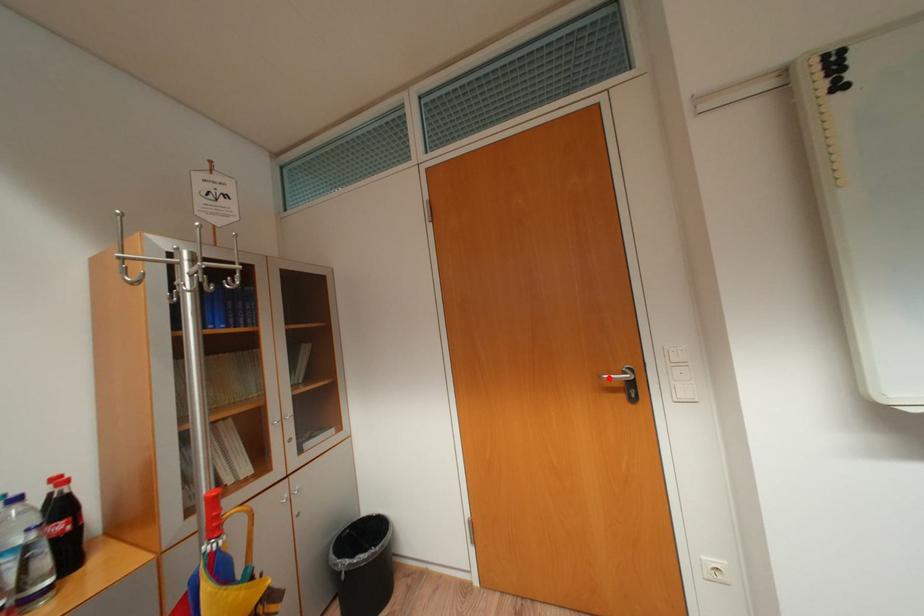
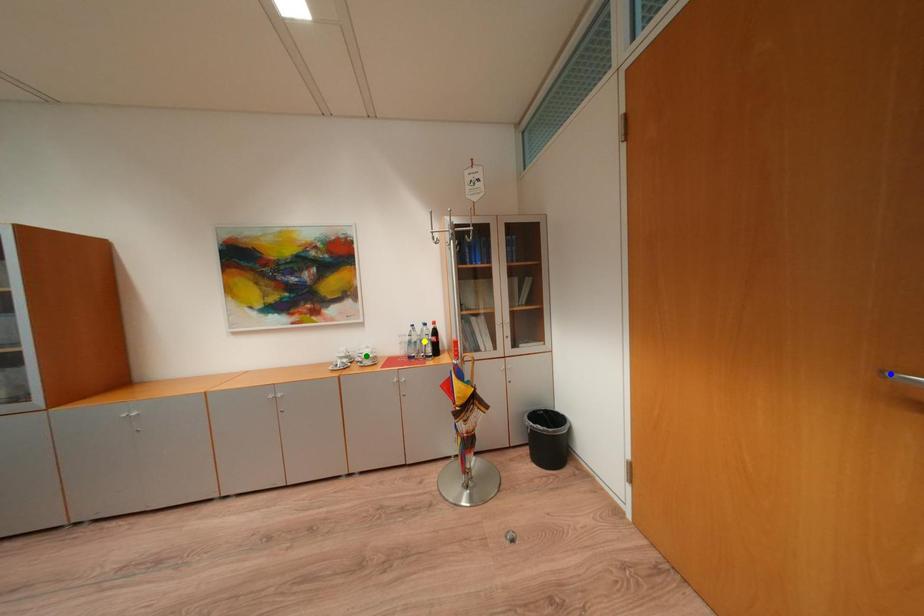
Question: I am providing you with two images of the same scene from different viewpoints. A red point is marked on the first image. You are given multiple points on the second image. In image 2, which mark is for the same physical point as the one in image 1?

Choices:
 (A) green point
 (B) blue point
 (C) yellow point

Answer: (B)